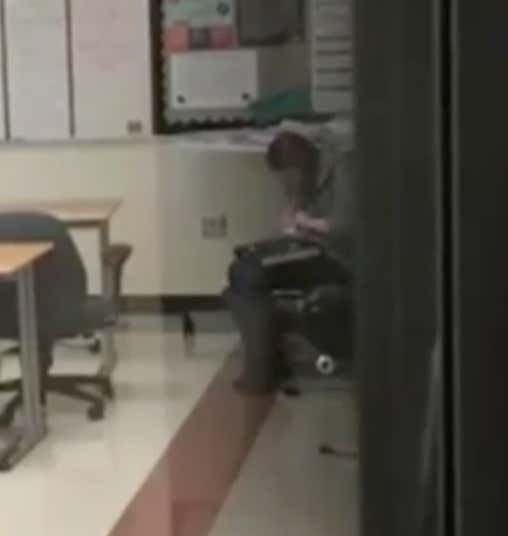
Where is `outlet`? This screenshot has width=508, height=536. outlet is located at coordinates (213, 228).